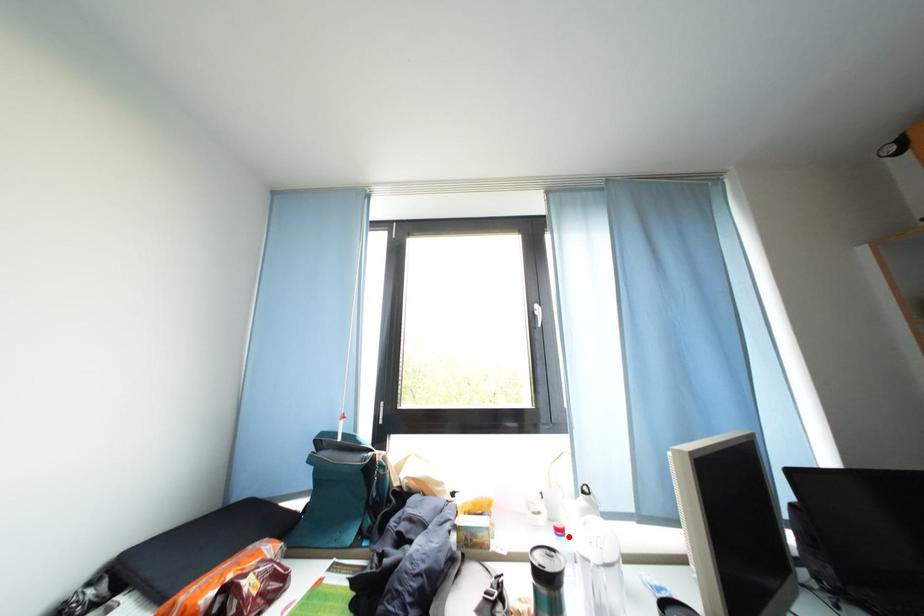
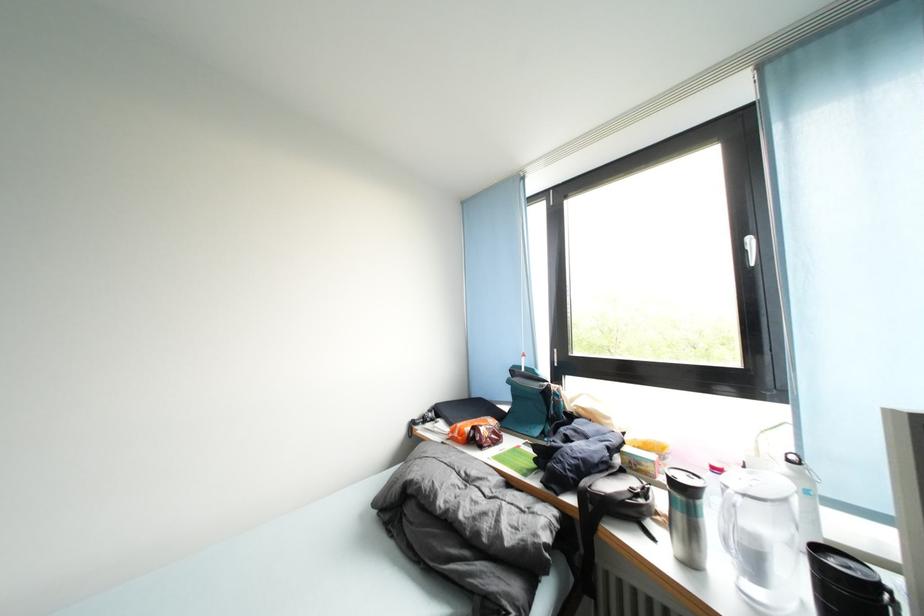
Question: I am providing you with two images of the same scene from different viewpoints. Image1 has a red point marked. In image2, the corresponding 3D location appears at what relative position? Reply with the corresponding letter.

Choices:
 (A) Closer
 (B) Farther

Answer: (B)